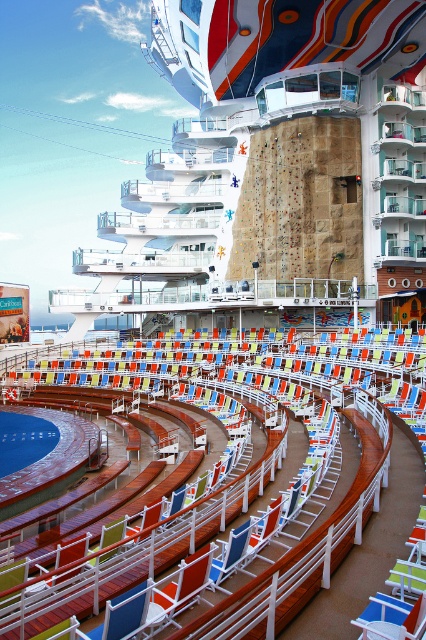
Question: Is white glossy cruise ship at center behind blue plastic beach chair at center?

Choices:
 (A) no
 (B) yes

Answer: (B)

Question: Is white glossy cruise ship at center wider than blue plastic beach chair at center?

Choices:
 (A) yes
 (B) no

Answer: (A)

Question: Which object is closer to the camera taking this photo?

Choices:
 (A) white glossy cruise ship at center
 (B) blue plastic beach chair at center

Answer: (B)

Question: Does white glossy cruise ship at center have a larger size compared to blue plastic beach chair at center?

Choices:
 (A) no
 (B) yes

Answer: (B)

Question: Which of the following is the farthest from the observer?

Choices:
 (A) (291, 272)
 (B) (417, 630)

Answer: (A)